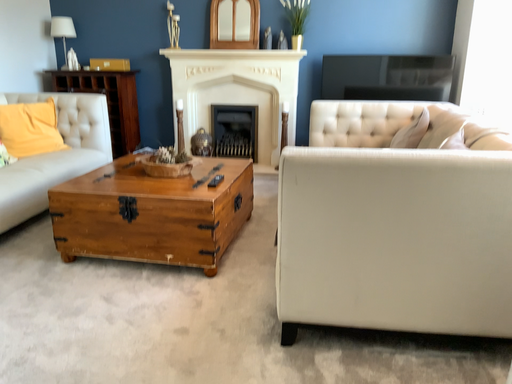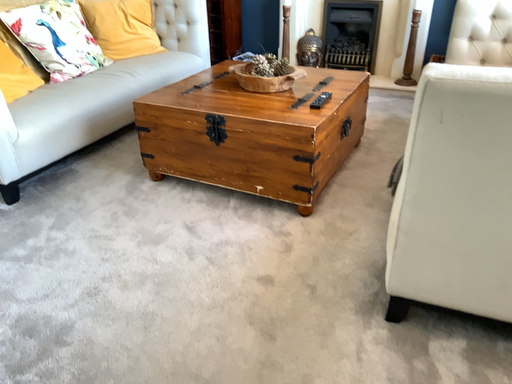
Question: Which way did the camera rotate in the video?

Choices:
 (A) rotated downward
 (B) rotated upward

Answer: (A)